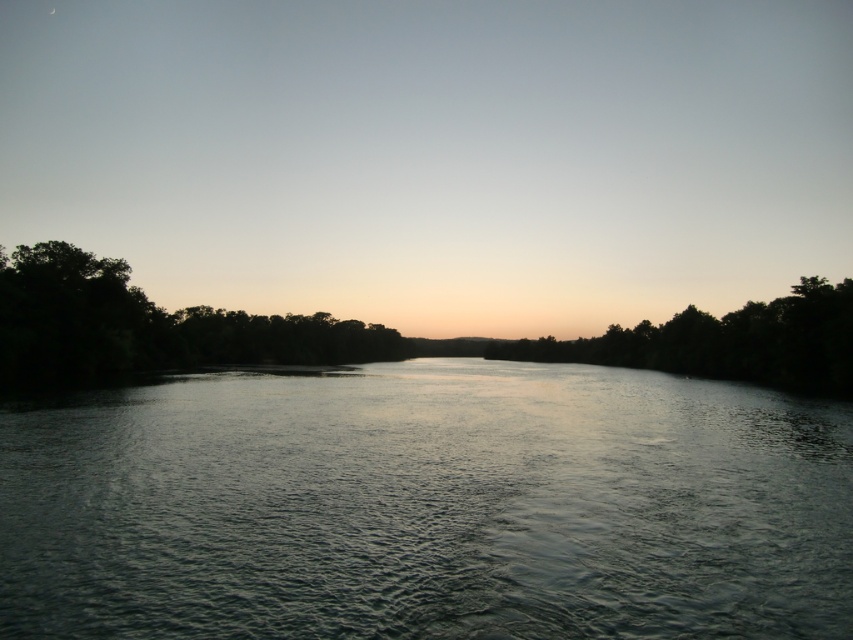
Question: Which point is closer to the camera?

Choices:
 (A) dark green leafy trees at left
 (B) silhouette leafy tree at center

Answer: (A)

Question: Estimate the real-world distances between objects in this image. Which object is closer to the dark gray water at center?

Choices:
 (A) dark green leafy trees at left
 (B) silhouette leafy tree at center

Answer: (A)

Question: Does dark gray water at center appear over dark green leafy trees at left?

Choices:
 (A) no
 (B) yes

Answer: (A)

Question: Estimate the real-world distances between objects in this image. Which object is farther from the dark green leafy trees at left?

Choices:
 (A) dark gray water at center
 (B) silhouette leafy tree at center

Answer: (B)

Question: Can you confirm if dark gray water at center is positioned to the left of dark green leafy trees at left?

Choices:
 (A) no
 (B) yes

Answer: (A)

Question: Is dark green leafy trees at left wider than silhouette leafy tree at center?

Choices:
 (A) no
 (B) yes

Answer: (A)